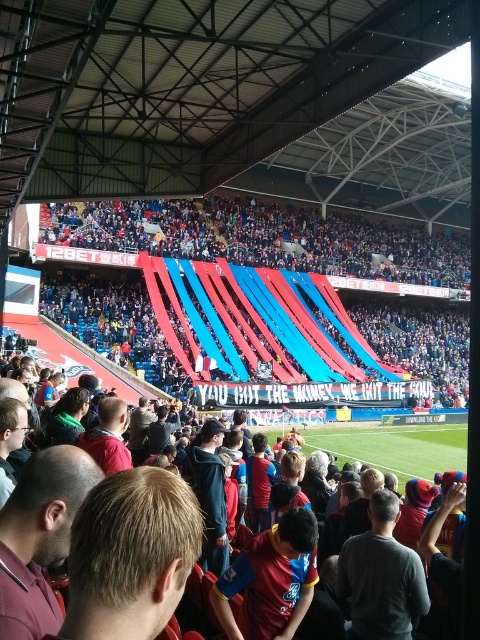
Is blue fabric banner at upper center shorter than red jersey at center?

No.

Which is more to the right, blue fabric banner at upper center or red jersey at center?

blue fabric banner at upper center

You are a GUI agent. You are given a task and a screenshot of the screen. Output one action in this format:
    pyautogui.click(x=<x>, y=<y>)
    Task: Click on the blue fabric banner at upper center
    Image resolution: width=480 pixels, height=640 pixels.
    Given the screenshot: What is the action you would take?
    pyautogui.click(x=267, y=237)